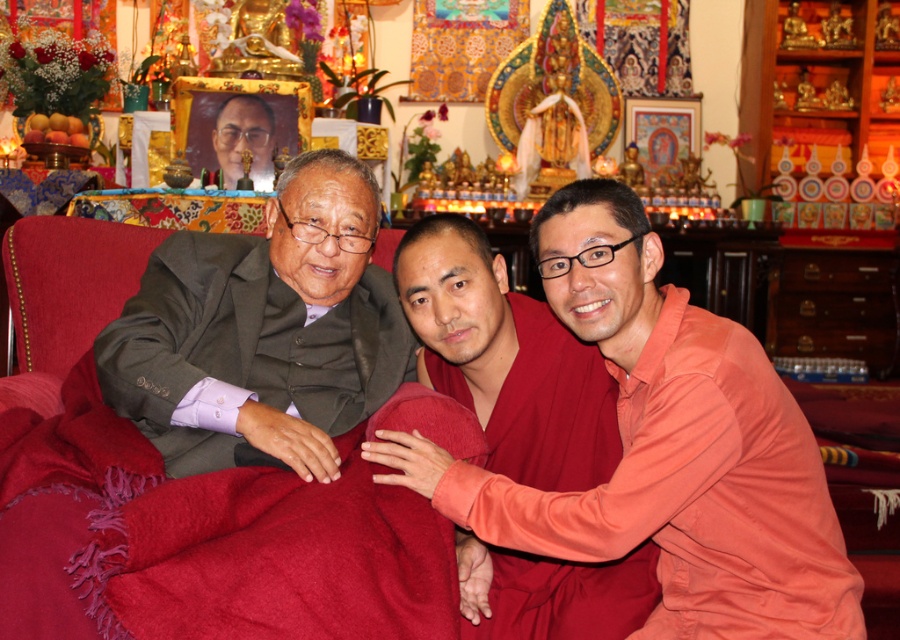
This screenshot has width=900, height=640. What do you see at coordinates (694, 493) in the screenshot? I see `smooth orange robe at right` at bounding box center [694, 493].

Does smooth orange robe at right have a smaller size compared to smooth orange shirt at center?

Incorrect, smooth orange robe at right is not smaller in size than smooth orange shirt at center.

Identify the location of smooth orange robe at right. The height and width of the screenshot is (640, 900). (694, 493).

The height and width of the screenshot is (640, 900). Identify the location of smooth orange robe at right. (694, 493).

Based on the photo, between smooth orange shirt at center and matte black portrait at center, which one appears on the right side from the viewer's perspective?

smooth orange shirt at center is more to the right.

Between point (515, 316) and point (240, 132), which one is positioned in front?

Point (515, 316) is in front.

This screenshot has width=900, height=640. I want to click on smooth orange shirt at center, so click(506, 358).

Does smooth orange robe at right appear over matte black portrait at center?

No, smooth orange robe at right is not above matte black portrait at center.

Is point (779, 577) more distant than point (270, 188)?

That is False.

Locate an element on the screen. smooth orange robe at right is located at coordinates (694, 493).